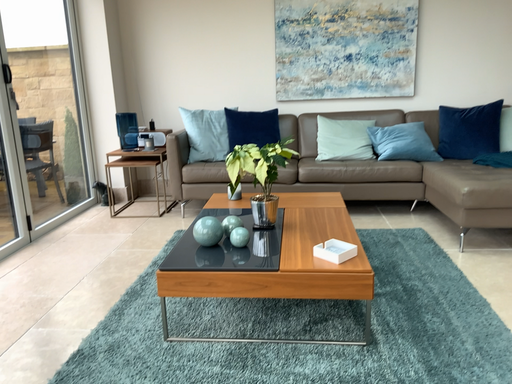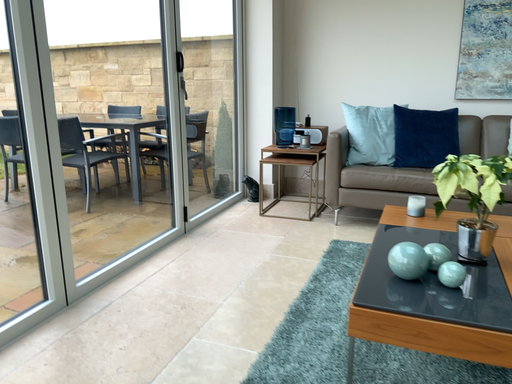
Question: Which way did the camera rotate in the video?

Choices:
 (A) rotated left
 (B) rotated right

Answer: (A)